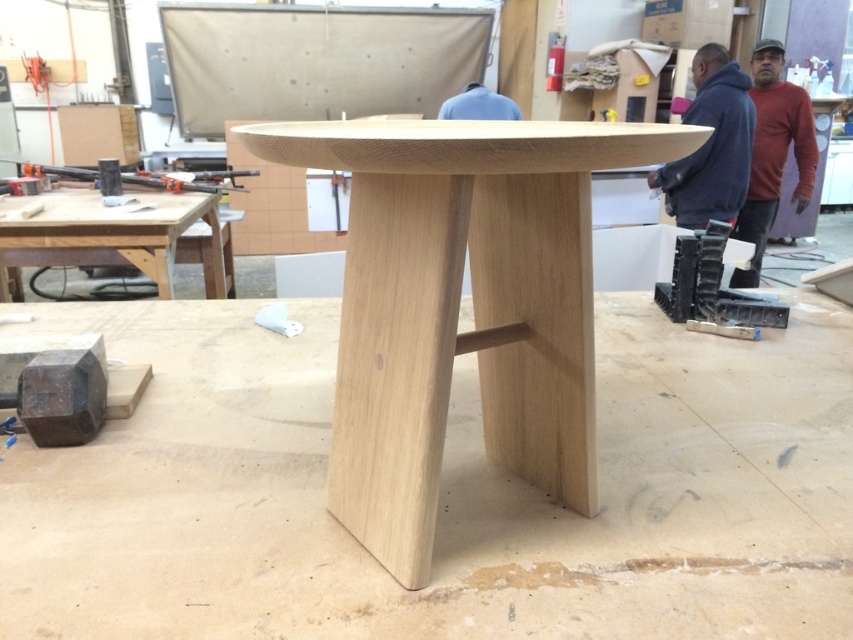
Consider the image. You are organizing a workshop event and need to seat 6 people. The natural wood table at center and natural wood table at left are available. Which table should you choose for seating more people?

The natural wood table at left is larger, so it can seat more people than the natural wood table at center.

You are organizing a workshop event and need to seat 6 people. The natural wood table at center and the natural wood table at left are available. Which table should you choose to accommodate more people?

The natural wood table at left has a greater width than the natural wood table at center, so it can accommodate more people.